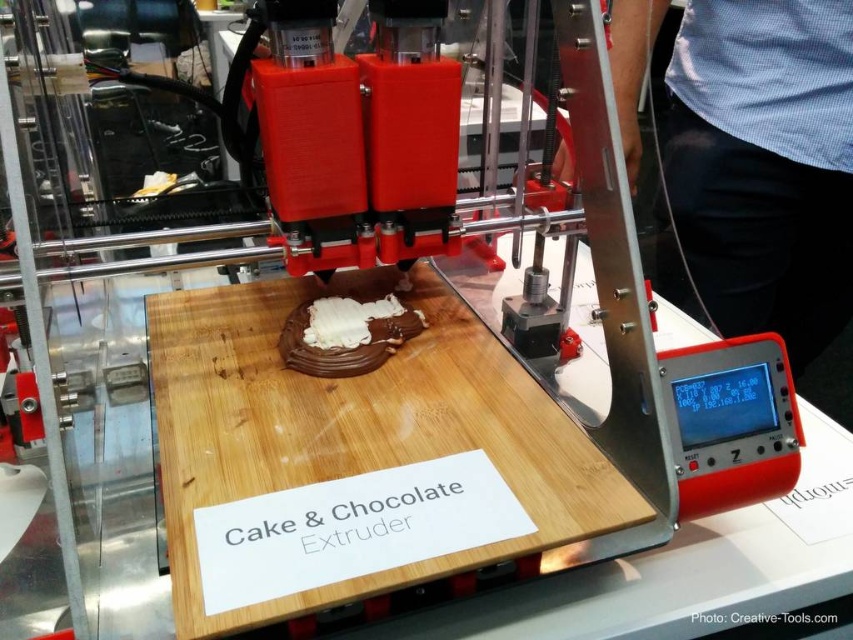
Question: Which of the following is the farthest from the observer?

Choices:
 (A) chocolate matte at center
 (B) wooden cutting board at center

Answer: (A)

Question: Among these points, which one is nearest to the camera?

Choices:
 (A) (337, 346)
 (B) (370, 316)
 (C) (316, 408)

Answer: (C)

Question: Is wooden cutting board at center behind chocolate matte at center?

Choices:
 (A) no
 (B) yes

Answer: (A)

Question: Can you confirm if wooden cutting board at center is thinner than white glossy frosting at center?

Choices:
 (A) no
 (B) yes

Answer: (A)

Question: Which point is closer to the camera taking this photo?

Choices:
 (A) (374, 332)
 (B) (180, 403)

Answer: (B)

Question: Does wooden cutting board at center appear under white glossy frosting at center?

Choices:
 (A) yes
 (B) no

Answer: (A)